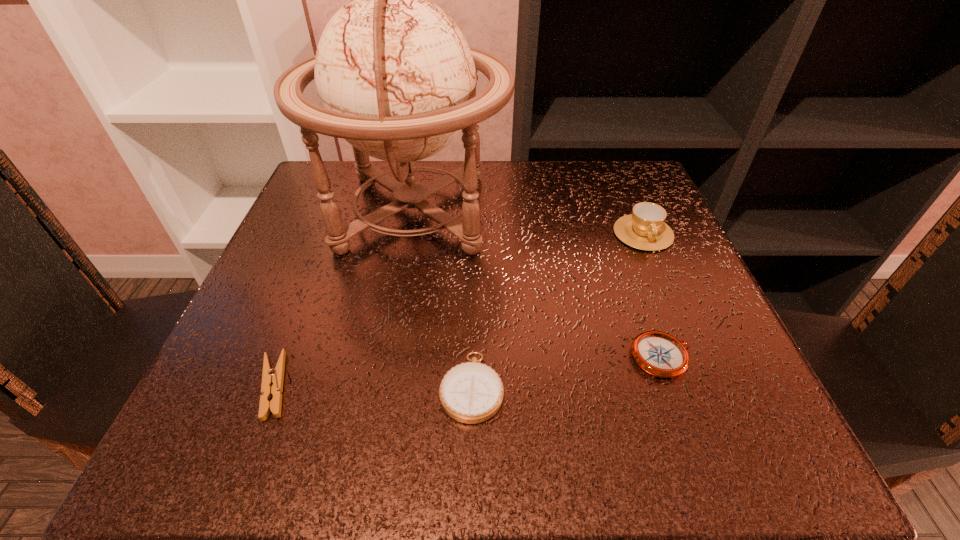
This screenshot has width=960, height=540. I want to click on vacant space that satisfies the following two spatial constraints: 1. on the back side of the right compass; 2. on the left side of the left compass, so click(x=472, y=357).

Find the location of `vacant space that satisfies the following two spatial constraints: 1. at the front of the right compass showing Africa; 2. on the left side of the tallest object`. vacant space that satisfies the following two spatial constraints: 1. at the front of the right compass showing Africa; 2. on the left side of the tallest object is located at coordinates (387, 357).

Where is `vacant space that satisfies the following two spatial constraints: 1. on the front side of the clothespin; 2. on the left side of the left compass`? The image size is (960, 540). vacant space that satisfies the following two spatial constraints: 1. on the front side of the clothespin; 2. on the left side of the left compass is located at coordinates (274, 387).

Find the location of a particular element. The image size is (960, 540). vacant space that satisfies the following two spatial constraints: 1. at the front of the tallest object showing Africa; 2. on the back side of the right compass is located at coordinates pyautogui.click(x=387, y=357).

This screenshot has height=540, width=960. I want to click on vacant area that satisfies the following two spatial constraints: 1. at the front of the left compass showing Africa; 2. on the right side of the tallest object, so click(x=381, y=387).